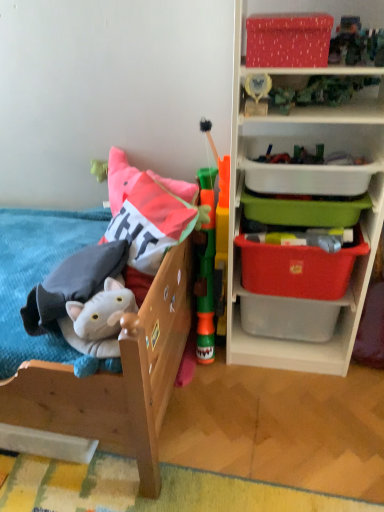
Describe the element at coordinates (291, 317) in the screenshot. I see `red plastic storage box at right, which is the 1th storage box in bottom-to-top order` at that location.

What do you see at coordinates (79, 353) in the screenshot? I see `wooden bed at left` at bounding box center [79, 353].

Identify the location of white plastic container at upper right, which ranks as the 2th storage box in top-to-bottom order. The height and width of the screenshot is (512, 384). (310, 152).

Describe the element at coordinates (298, 269) in the screenshot. The width and height of the screenshot is (384, 512). I see `red plastic storage box at right, which is counted as the second storage box, starting from the bottom` at that location.

The width and height of the screenshot is (384, 512). What are the coordinates of `red plastic storage box at right, the fourth storage box in the top-to-bottom sequence` in the screenshot? It's located at [x=298, y=269].

Image resolution: width=384 pixels, height=512 pixels. I want to click on matte red fabric storage box at upper right, positioned as the fifth storage box in bottom-to-top order, so click(288, 40).

Locate an element on the screen. The height and width of the screenshot is (512, 384). plastic storage bins at right is located at coordinates (291, 151).

How different are the orientations of wooden bed at left and white plastic container at upper right, the fourth storage box positioned from the bottom, in degrees?

90 degrees.

Is wooden bed at left located outside white plastic container at upper right, the fourth storage box positioned from the bottom?

Yes.

Is wooden bed at left shorter than white plastic container at upper right, which ranks as the 2th storage box in top-to-bottom order?

In fact, wooden bed at left may be taller than white plastic container at upper right, which ranks as the 2th storage box in top-to-bottom order.

From a real-world perspective, which object rests below the other?

In real-world perspective, wooden bed at left is lower.

Is matte red fabric storage box at upper right, positioned as the fifth storage box in bottom-to-top order, positioned in front of soft plush cat at left, marked as the 2th toy in a right-to-left arrangement?

No, it is behind soft plush cat at left, marked as the 2th toy in a right-to-left arrangement.

Is matte red fabric storage box at upper right, positioned as the fifth storage box in bottom-to-top order, taller than soft plush cat at left, marked as the 2th toy in a right-to-left arrangement?

In fact, matte red fabric storage box at upper right, positioned as the fifth storage box in bottom-to-top order, may be shorter than soft plush cat at left, marked as the 2th toy in a right-to-left arrangement.

Identify the location of the 1st storage box behind the soft plush cat at left, marked as the 2th toy in a right-to-left arrangement. (288, 40).

Is soft plush cat at left, marked as the 2th toy in a right-to-left arrangement, at the back of matte red fabric storage box at upper right, positioned as the fifth storage box in bottom-to-top order?

No, matte red fabric storage box at upper right, positioned as the fifth storage box in bottom-to-top order, is not facing away from soft plush cat at left, marked as the 2th toy in a right-to-left arrangement.

From a real-world perspective, is red plastic storage box at right, acting as the fifth storage box starting from the top, physically below wooden bed at left?

Yes, from a real-world perspective, red plastic storage box at right, acting as the fifth storage box starting from the top, is beneath wooden bed at left.

Between red plastic storage box at right, acting as the fifth storage box starting from the top, and wooden bed at left, which one appears on the right side from the viewer's perspective?

Positioned to the right is red plastic storage box at right, acting as the fifth storage box starting from the top.

What's the angular difference between red plastic storage box at right, acting as the fifth storage box starting from the top, and wooden bed at left's facing directions?

red plastic storage box at right, acting as the fifth storage box starting from the top, and wooden bed at left are facing 90 degrees away from each other.

What's the angular difference between red plastic storage box at right, which is counted as the second storage box, starting from the bottom, and wooden bed at left's facing directions?

The angle between the facing direction of red plastic storage box at right, which is counted as the second storage box, starting from the bottom, and the facing direction of wooden bed at left is 90 degrees.

From the image's perspective, which object appears higher, red plastic storage box at right, which is counted as the second storage box, starting from the bottom, or wooden bed at left?

red plastic storage box at right, which is counted as the second storage box, starting from the bottom, is shown above in the image.

Is red plastic storage box at right, the fourth storage box in the top-to-bottom sequence, oriented towards wooden bed at left?

No, red plastic storage box at right, the fourth storage box in the top-to-bottom sequence, is not oriented towards wooden bed at left.

From a real-world perspective, which object stands above the other?

In real-world perspective, red plastic storage box at right, which is counted as the second storage box, starting from the bottom, is above.

From the plastic storage bins at right, count the 2nd toy to the left and point to it. Please provide its 2D coordinates.

[(82, 295)]

Measure the distance between soft plush cat at left, the first toy in the left-to-right sequence, and plastic storage bins at right.

soft plush cat at left, the first toy in the left-to-right sequence, and plastic storage bins at right are 25.55 inches apart.

Consider the image. Considering the positions of objects soft plush cat at left, marked as the 2th toy in a right-to-left arrangement, and plastic storage bins at right in the image provided, who is more to the right, soft plush cat at left, marked as the 2th toy in a right-to-left arrangement, or plastic storage bins at right?

plastic storage bins at right is more to the right.

Considering the relative sizes of white plastic container at upper right, the fourth storage box positioned from the bottom, and wooden bed at left in the image provided, is white plastic container at upper right, the fourth storage box positioned from the bottom, shorter than wooden bed at left?

Correct, white plastic container at upper right, the fourth storage box positioned from the bottom, is not as tall as wooden bed at left.

Is point (273, 122) positioned in front of point (82, 432)?

No.

Is white plastic container at upper right, which ranks as the 2th storage box in top-to-bottom order, in front of or behind wooden bed at left in the image?

white plastic container at upper right, which ranks as the 2th storage box in top-to-bottom order, is behind wooden bed at left.

Is white plastic container at upper right, the fourth storage box positioned from the bottom, thinner than wooden bed at left?

Yes.

Is point (223, 258) closer or farther from the camera than point (379, 139)?

Point (223, 258) is positioned farther from the camera compared to point (379, 139).

How distant is green plastic tower at center, which ranks as the 2th toy in left-to-right order, from white plastic container at upper right, the fourth storage box positioned from the bottom?

The distance of green plastic tower at center, which ranks as the 2th toy in left-to-right order, from white plastic container at upper right, the fourth storage box positioned from the bottom, is 13.10 inches.

Is green plastic tower at center, which ranks as the 2th toy in left-to-right order, not inside white plastic container at upper right, which ranks as the 2th storage box in top-to-bottom order?

That's correct, green plastic tower at center, which ranks as the 2th toy in left-to-right order, is outside of white plastic container at upper right, which ranks as the 2th storage box in top-to-bottom order.

Identify the location of infant bed lying on the left of white plastic container at upper right, the fourth storage box positioned from the bottom. This screenshot has width=384, height=512. (79, 353).

The width and height of the screenshot is (384, 512). In order to click on the 4th storage box above the soft plush cat at left, the first toy in the left-to-right sequence (from the image's perspective) in this screenshot , I will do `click(288, 40)`.

Based on their spatial positions, is soft plush cat at left, marked as the 2th toy in a right-to-left arrangement, or red plastic storage box at right, the fourth storage box in the top-to-bottom sequence, closer to white plastic container at upper right, the fourth storage box positioned from the bottom?

red plastic storage box at right, the fourth storage box in the top-to-bottom sequence.

When comparing their distances from green plastic tower at center, which ranks as the 2th toy in left-to-right order, does plastic storage bins at right or green plastic container at upper right, the 3th storage box viewed from the top, seem closer?

Based on the image, plastic storage bins at right appears to be nearer to green plastic tower at center, which ranks as the 2th toy in left-to-right order.

Based on their spatial positions, is green plastic tower at center, which ranks as the 2th toy in left-to-right order, or red plastic storage box at right, which is the 1th storage box in bottom-to-top order, closer to matte red fabric storage box at upper right, positioned as the fifth storage box in bottom-to-top order?

green plastic tower at center, which ranks as the 2th toy in left-to-right order, is positioned closer to the anchor matte red fabric storage box at upper right, positioned as the fifth storage box in bottom-to-top order.

Looking at the image, which one is located closer to green plastic tower at center, which ranks as the 2th toy in left-to-right order, green plastic container at upper right, the 3th storage box viewed from the top, or red plastic storage box at right, the fourth storage box in the top-to-bottom sequence?

red plastic storage box at right, the fourth storage box in the top-to-bottom sequence, lies closer to green plastic tower at center, which ranks as the 2th toy in left-to-right order, than the other object.

Based on their spatial positions, is green plastic tower at center, which ranks as the 2th toy in left-to-right order, or matte red fabric storage box at upper right, the first storage box viewed from the top, closer to soft plush cat at left, the first toy in the left-to-right sequence?

green plastic tower at center, which ranks as the 2th toy in left-to-right order, is closer to soft plush cat at left, the first toy in the left-to-right sequence.

Considering their positions, is green plastic tower at center, which ranks as the 2th toy in left-to-right order, positioned closer to wooden bed at left than red plastic storage box at right, which is counted as the second storage box, starting from the bottom?

green plastic tower at center, which ranks as the 2th toy in left-to-right order.

Based on their spatial positions, is matte red fabric storage box at upper right, the first storage box viewed from the top, or red plastic storage box at right, acting as the fifth storage box starting from the top, further from green plastic tower at center, which ranks as the 2th toy in left-to-right order?

matte red fabric storage box at upper right, the first storage box viewed from the top.

From the image, which object appears to be farther from plastic storage bins at right, matte red fabric storage box at upper right, positioned as the fifth storage box in bottom-to-top order, or green plastic tower at center, which ranks as the 2th toy in left-to-right order?

matte red fabric storage box at upper right, positioned as the fifth storage box in bottom-to-top order, is further to plastic storage bins at right.

Find the location of a particular element. This screenshot has height=512, width=384. shelf between soft plush cat at left, the first toy in the left-to-right sequence, and green plastic container at upper right, the 3th storage box viewed from the top is located at coordinates (291, 151).

What are the coordinates of `storage box between matte red fabric storage box at upper right, the first storage box viewed from the top, and green plastic container at upper right, which ranks as the third storage box in bottom-to-top order, from top to bottom` in the screenshot? It's located at (310, 152).

Identify the location of shelf situated between wooden bed at left and green plastic container at upper right, which ranks as the third storage box in bottom-to-top order, from left to right. (291, 151).

At what (x,y) coordinates should I click in order to perform the action: click on toy between matte red fabric storage box at upper right, positioned as the fifth storage box in bottom-to-top order, and soft plush cat at left, marked as the 2th toy in a right-to-left arrangement, vertically. Please return your answer as a coordinate pair (x, y). Looking at the image, I should click on [x=220, y=233].